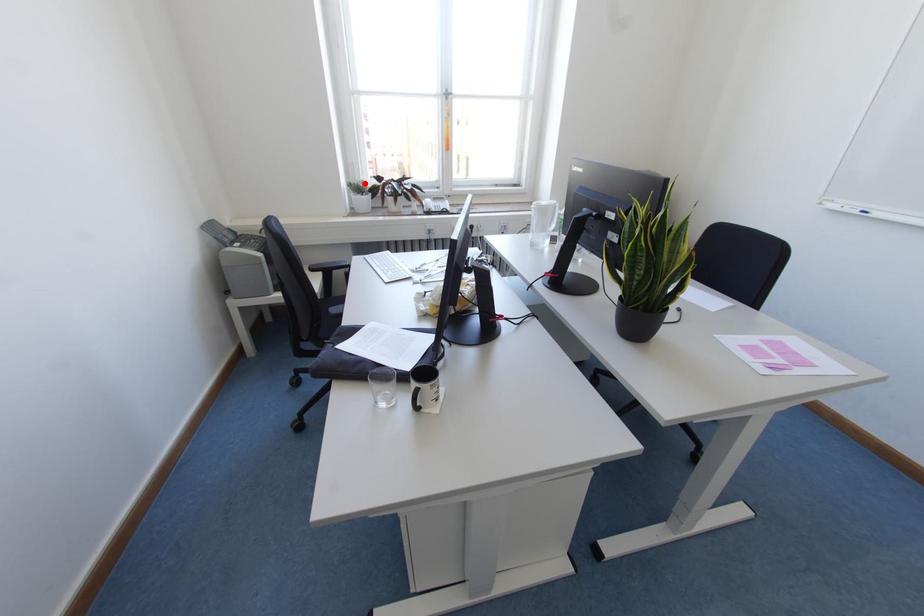
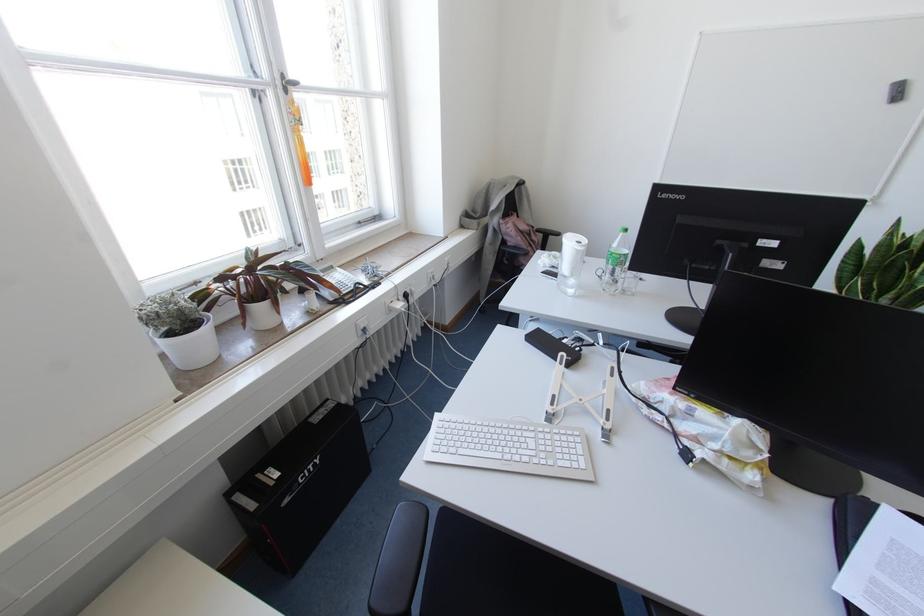
In the second image, find the point that corresponds to the highlighted location in the first image.

(186, 298)